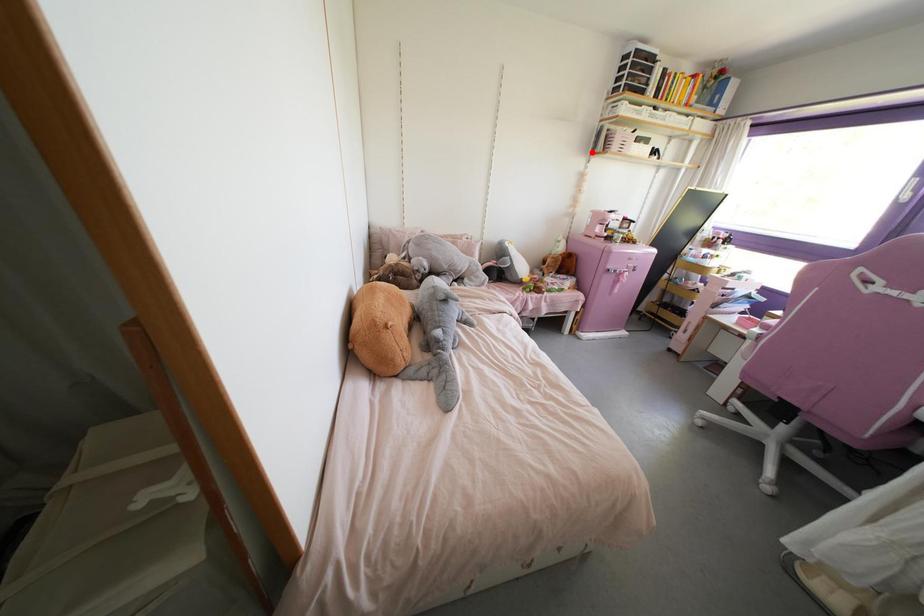
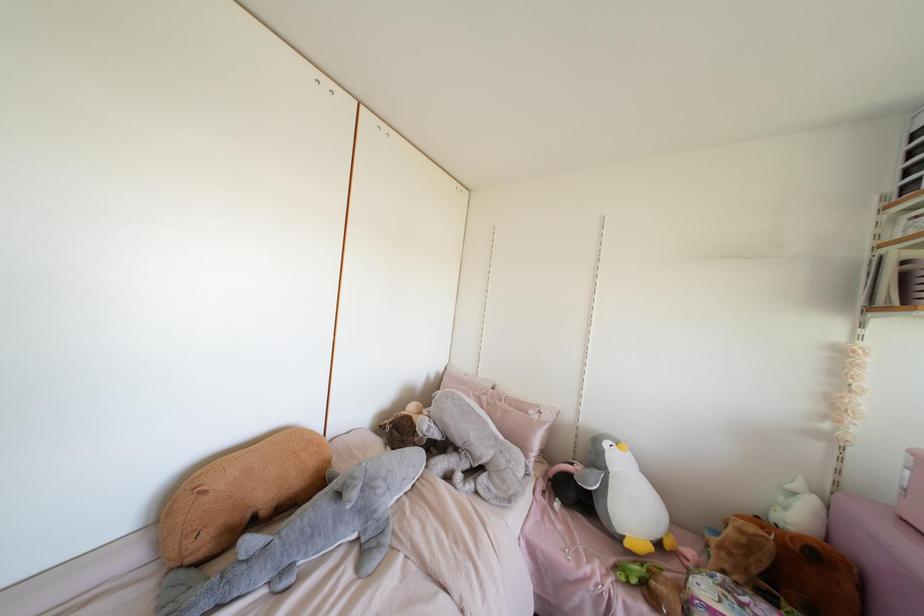
In the second image, find the point that corresponds to the highlighted location in the first image.

(870, 307)